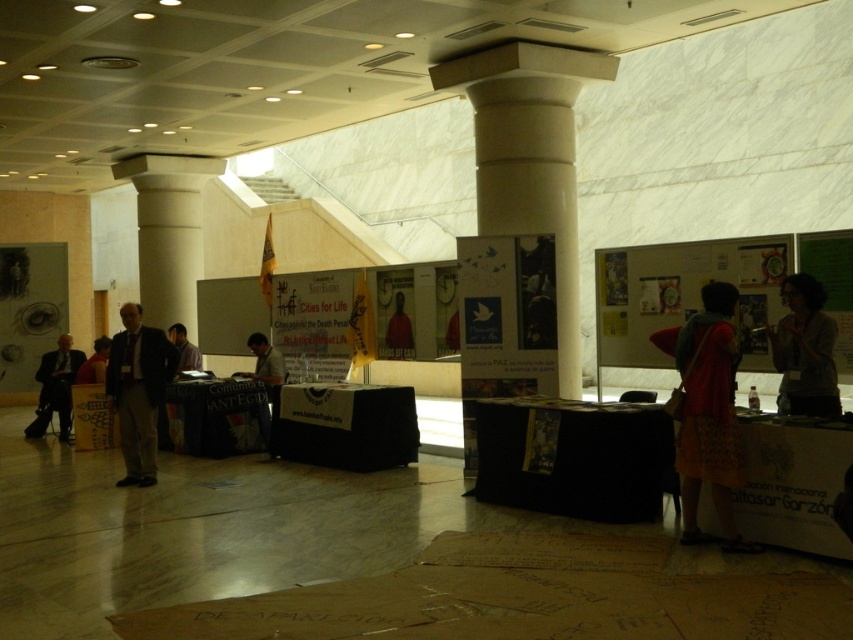
You are attending an event in the conference hall and notice a white marble pillar at upper center and a matte red shirt at center. Which object is located higher in the image?

A: The white marble pillar at upper center is positioned over the matte red shirt at center, meaning it is higher up in the image.